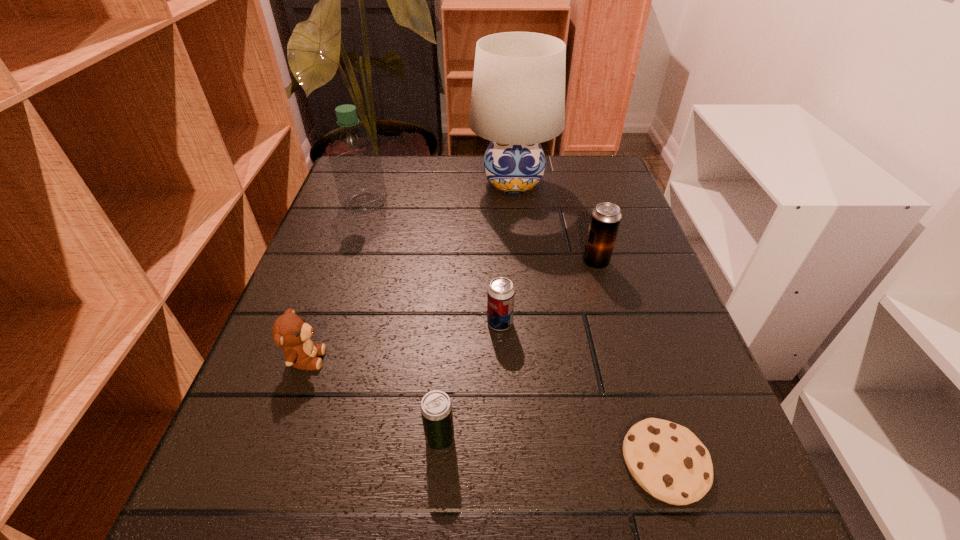
This screenshot has width=960, height=540. I want to click on vacant space that satisfies the following two spatial constraints: 1. on the back side of the second nearest beer can; 2. on the right side of the tallest beer can, so click(497, 262).

Locate an element on the screen. The image size is (960, 540). vacant area in the image that satisfies the following two spatial constraints: 1. on the back side of the leftmost beer can; 2. on the face of the teddy bear is located at coordinates (445, 359).

The height and width of the screenshot is (540, 960). I want to click on free location that satisfies the following two spatial constraints: 1. on the face of the third object from left to right; 2. on the left side of the teddy bear, so click(278, 438).

Where is `free region that satisfies the following two spatial constraints: 1. on the front-facing side of the third tallest object; 2. on the left side of the lampshade`? free region that satisfies the following two spatial constraints: 1. on the front-facing side of the third tallest object; 2. on the left side of the lampshade is located at coordinates click(521, 262).

Identify the location of vacant space that satisfies the following two spatial constraints: 1. on the front side of the shortest object; 2. on the left side of the farthest beer can. (654, 462).

At what (x,y) coordinates should I click in order to perform the action: click on vacant area that satisfies the following two spatial constraints: 1. on the front side of the second tallest object; 2. on the face of the teddy bear. Please return your answer as a coordinate pair (x, y). This screenshot has height=540, width=960. Looking at the image, I should click on (312, 359).